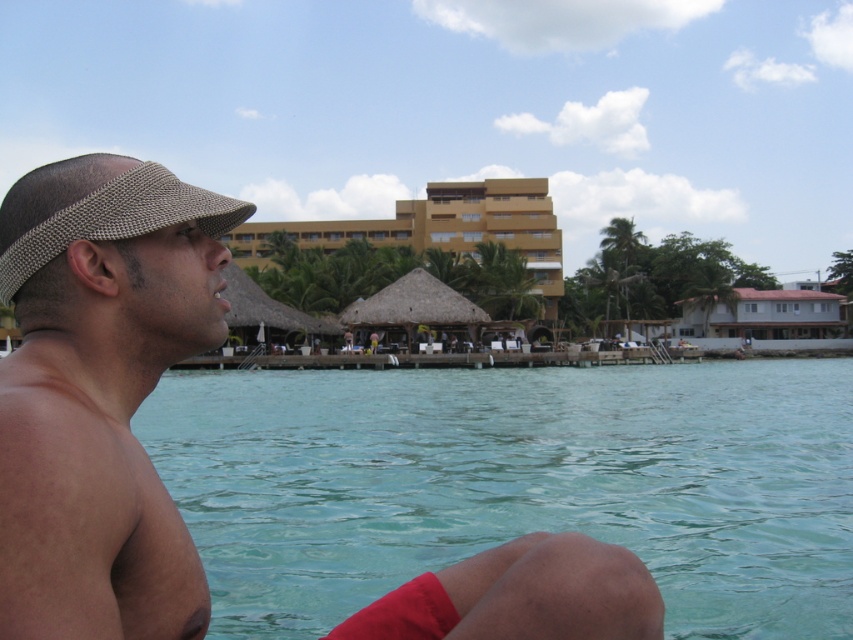
Is point (544, 218) in front of point (805, 320)?

No.

Does yellow matte building at center come in front of brown corrugated metal roof at lower right?

Yes, yellow matte building at center is in front of brown corrugated metal roof at lower right.

Who is more forward, (520, 193) or (833, 328)?

Point (833, 328) is in front.

At what (x,y) coordinates should I click in order to perform the action: click on yellow matte building at center. Please return your answer as a coordinate pair (x, y). The width and height of the screenshot is (853, 640). Looking at the image, I should click on (436, 228).

Does point (566, 397) lie in front of point (33, 336)?

No, it is not.

Between clear blue water at lower left and knitted beige visor at left, which one has more height?

knitted beige visor at left is taller.

Describe the element at coordinates (515, 483) in the screenshot. I see `clear blue water at lower left` at that location.

Where is `clear blue water at lower left`? The image size is (853, 640). clear blue water at lower left is located at coordinates (515, 483).

In the scene shown: Between knitted beige visor at left and woven fabric visor at left, which one is positioned lower?

knitted beige visor at left is below.

Between point (209, 211) and point (28, 173), which one is positioned in front?

Point (209, 211) is more forward.

The image size is (853, 640). I want to click on knitted beige visor at left, so click(100, 394).